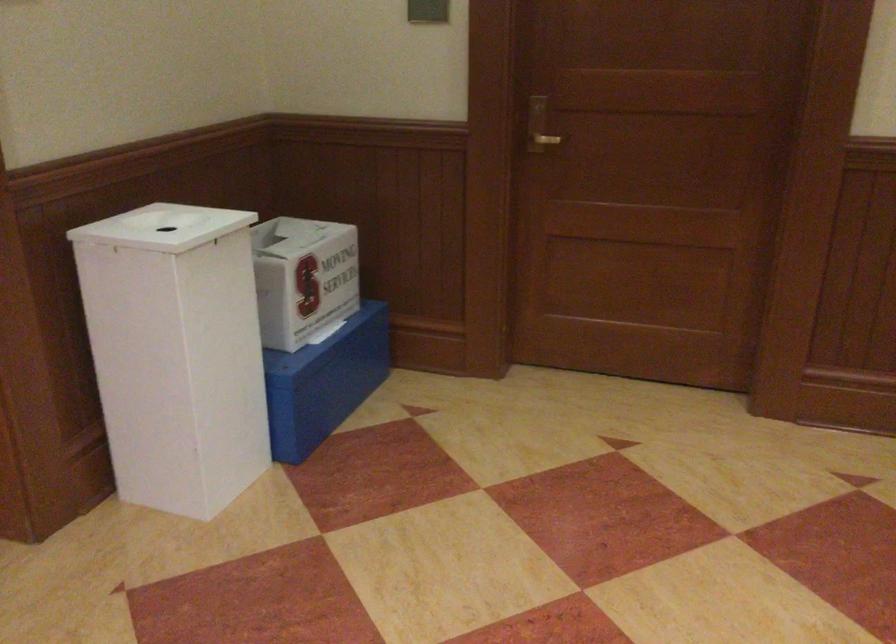
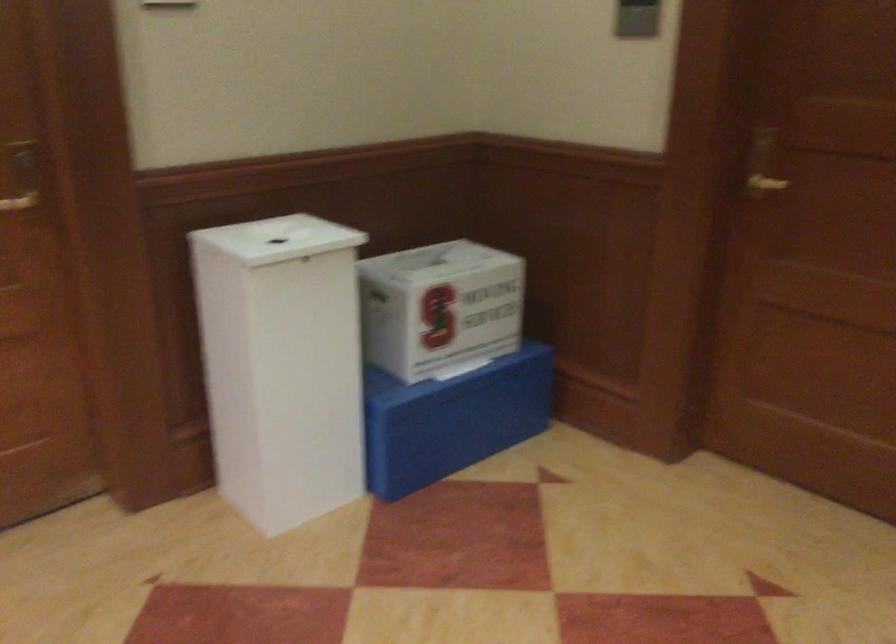
Locate, in the second image, the point that corresponds to point (545, 120) in the first image.

(762, 164)